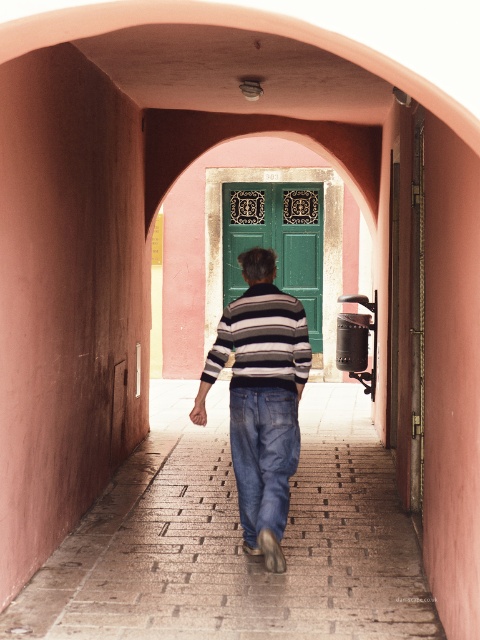
Question: Which object appears farthest from the camera in this image?

Choices:
 (A) denim at center
 (B) green painted wood door at center
 (C) smooth stone path at center

Answer: (B)

Question: Which point appears closest to the camera in this image?

Choices:
 (A) (215, 401)
 (B) (284, 260)
 (C) (283, 417)

Answer: (C)

Question: Can you confirm if smooth stone path at center is positioned to the right of denim at center?

Choices:
 (A) no
 (B) yes

Answer: (A)

Question: Does green painted wood door at center have a smaller size compared to denim at center?

Choices:
 (A) no
 (B) yes

Answer: (A)

Question: Among these points, which one is nearest to the camera?

Choices:
 (A) (252, 381)
 (B) (240, 500)

Answer: (A)

Question: Does smooth stone path at center appear on the right side of striped cotton shirt at center?

Choices:
 (A) no
 (B) yes

Answer: (A)